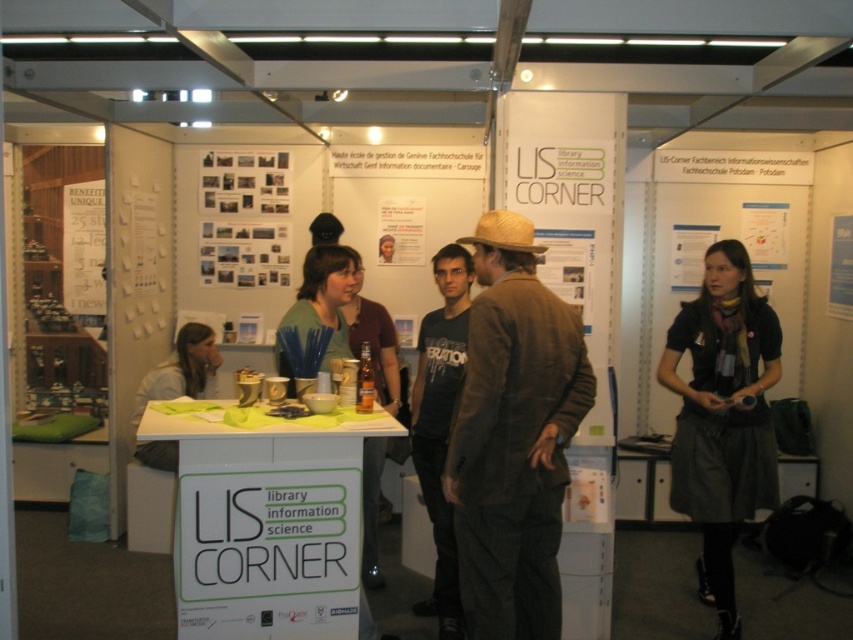
Question: Which object appears closest to the camera in this image?

Choices:
 (A) brown glass bottle at center
 (B) printed paper collage at center
 (C) white paper poster at left

Answer: (A)

Question: Does white paper poster at center have a smaller size compared to matte paper poster at center?

Choices:
 (A) yes
 (B) no

Answer: (B)

Question: Can you confirm if white paper at center is smaller than white paper poster at center?

Choices:
 (A) yes
 (B) no

Answer: (B)

Question: Which of these objects is positioned closest to the white paper at upper center?

Choices:
 (A) brown woolen jacket at center
 (B) white paper poster at left
 (C) white paper poster at upper right
 (D) light brown hair at lower left

Answer: (C)

Question: Can you confirm if dark gray t-shirt at center is smaller than matte brown jacket at center?

Choices:
 (A) no
 (B) yes

Answer: (B)

Question: Which point is farther to the camera?

Choices:
 (A) light brown hair at lower left
 (B) white paper poster at upper right
 (C) brown woolen jacket at center

Answer: (B)